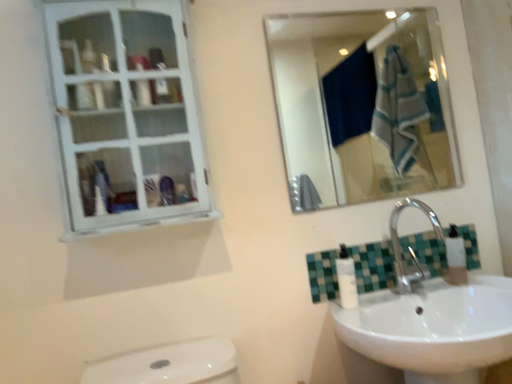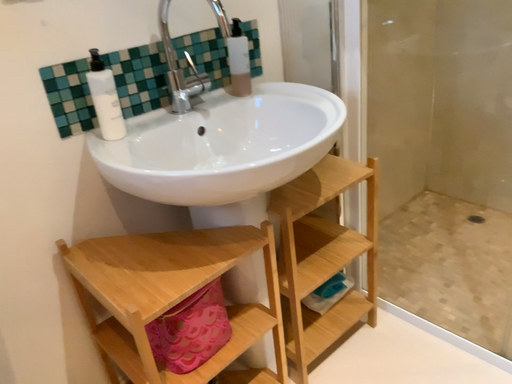
Question: Which way did the camera rotate in the video?

Choices:
 (A) rotated right
 (B) rotated left

Answer: (A)